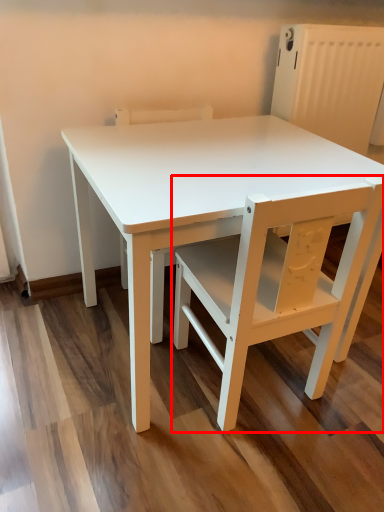
Question: From the image's perspective, what is the correct spatial positioning of chair (annotated by the red box) in reference to chair?

Choices:
 (A) above
 (B) below

Answer: (B)